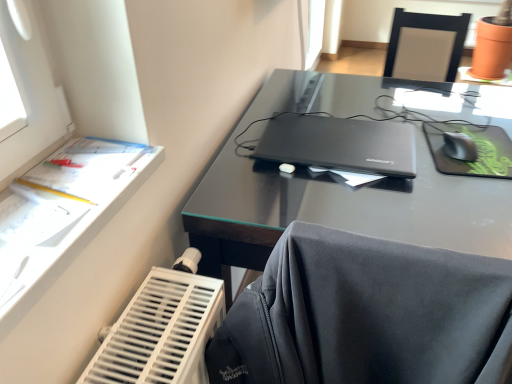
Locate an element on the screen. vacant area in front of black plastic mouse at right is located at coordinates (460, 189).